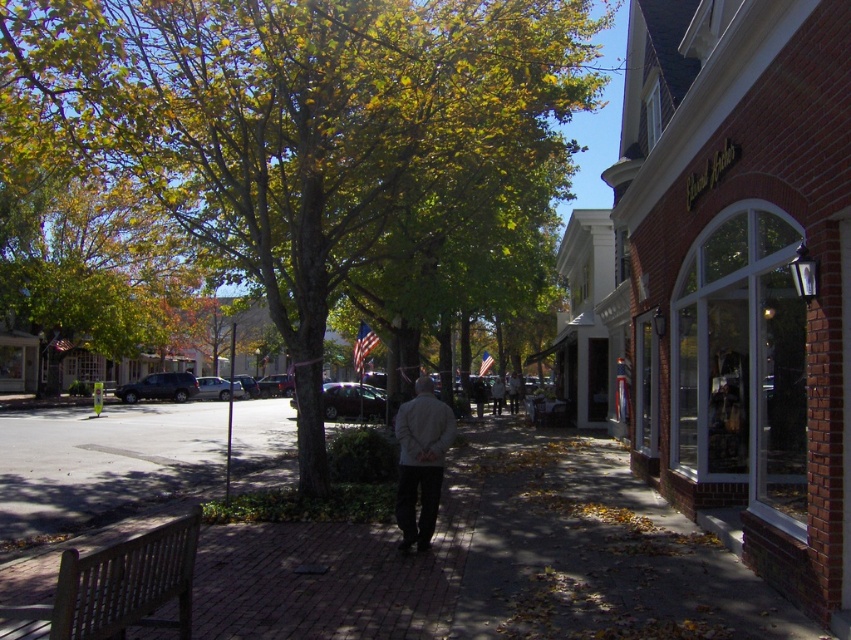
Question: Estimate the real-world distances between objects in this image. Which object is farther from the wooden bench at lower left?

Choices:
 (A) green leafy tree at center
 (B) brick pavement at center
 (C) light gray jacket at center

Answer: (A)

Question: Is green leafy tree at center below brick pavement at center?

Choices:
 (A) no
 (B) yes

Answer: (A)

Question: Considering the relative positions of brick pavement at center and light gray jacket at center in the image provided, where is brick pavement at center located with respect to light gray jacket at center?

Choices:
 (A) below
 (B) above

Answer: (A)

Question: Does brick pavement at center have a lesser width compared to wooden bench at lower left?

Choices:
 (A) no
 (B) yes

Answer: (A)

Question: Among these objects, which one is farthest from the camera?

Choices:
 (A) wooden bench at lower left
 (B) green leafy tree at center

Answer: (B)

Question: Which object is positioned closest to the green leafy tree at center?

Choices:
 (A) wooden bench at lower left
 (B) brick pavement at center
 (C) light gray jacket at center

Answer: (B)